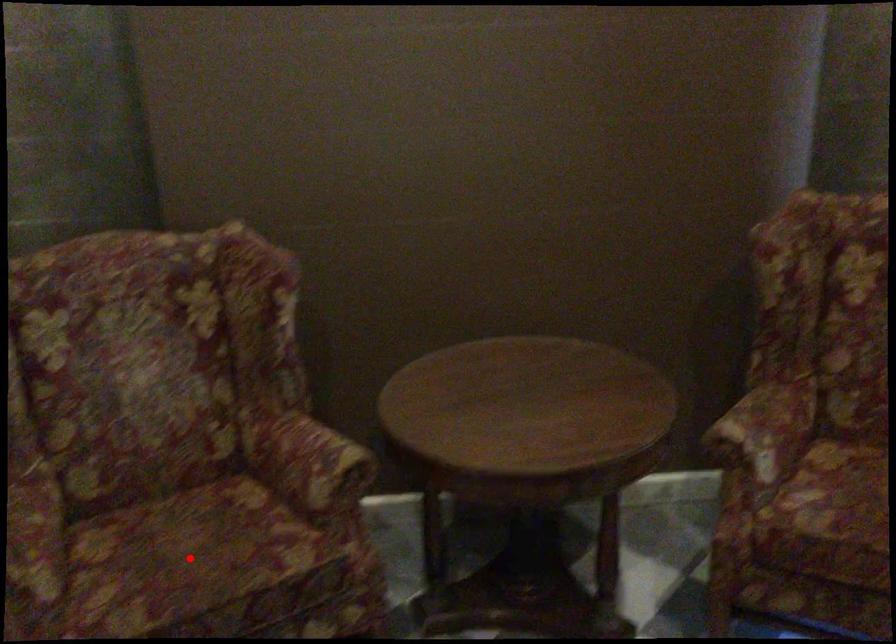
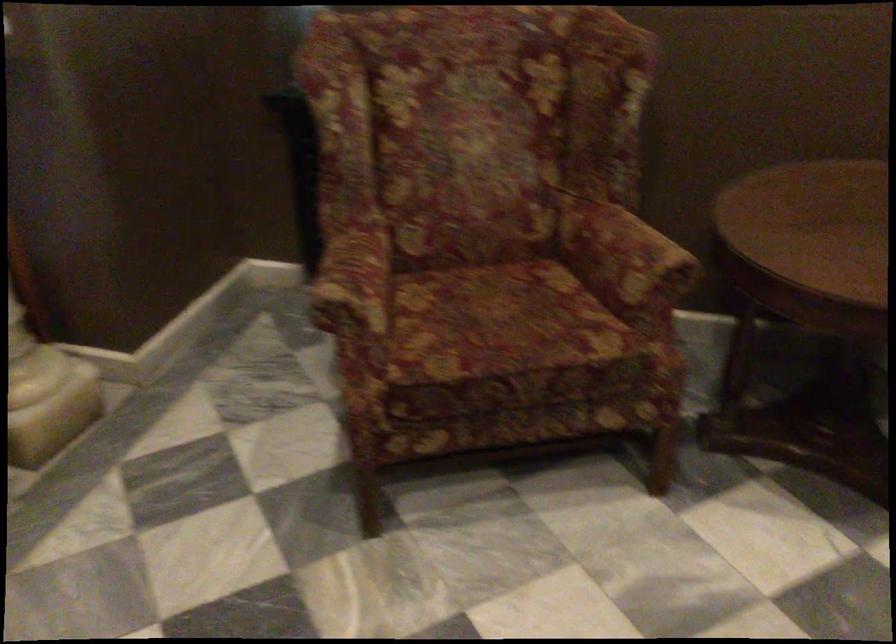
The point at the highlighted location is marked in the first image. Where is the corresponding point in the second image?

(501, 323)